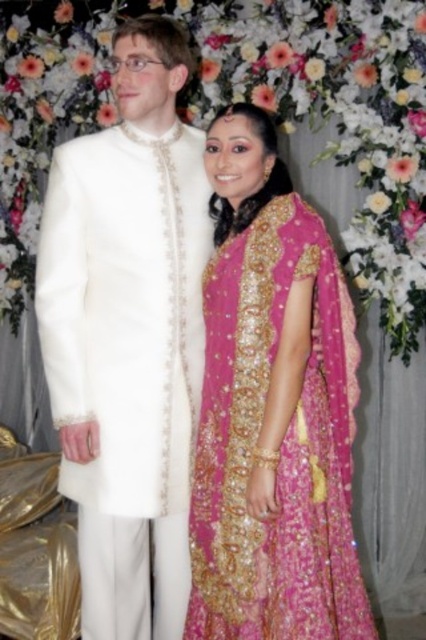
Is point (164, 579) closer to camera compared to point (279, 544)?

No, (164, 579) is further to viewer.

Which is behind, point (137, 636) or point (316, 608)?

The point (137, 636) is more distant.

Identify the location of white satin sherwani at left. (129, 336).